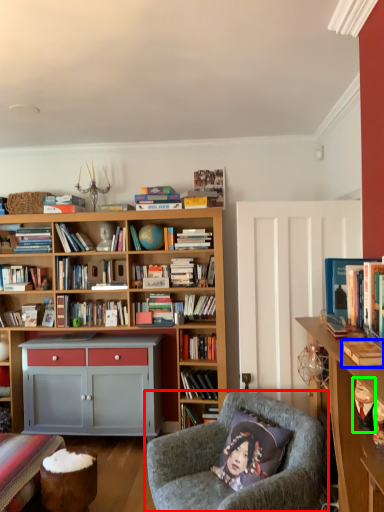
Question: Based on their relative distances, which object is nearer to chair (highlighted by a red box)? Choose from book (highlighted by a blue box) and toy (highlighted by a green box).

Choices:
 (A) book
 (B) toy

Answer: (B)